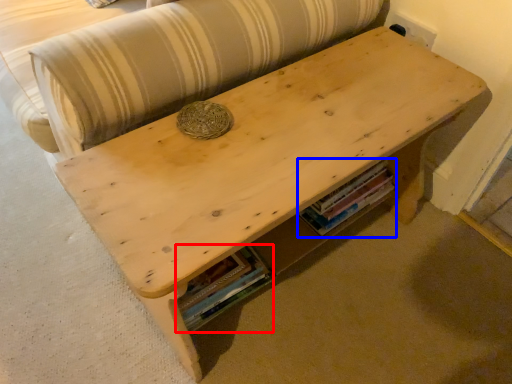
Question: Which object appears closest to the camera in this image, book (highlighted by a red box) or book (highlighted by a blue box)?

Choices:
 (A) book
 (B) book

Answer: (A)